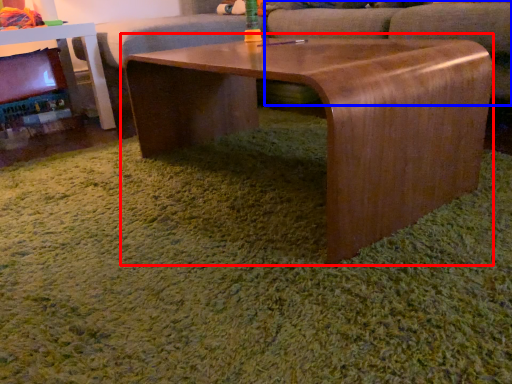
Question: Which point is further to the camera, coffee table (highlighted by a red box) or swivel chair (highlighted by a blue box)?

Choices:
 (A) coffee table
 (B) swivel chair

Answer: (B)